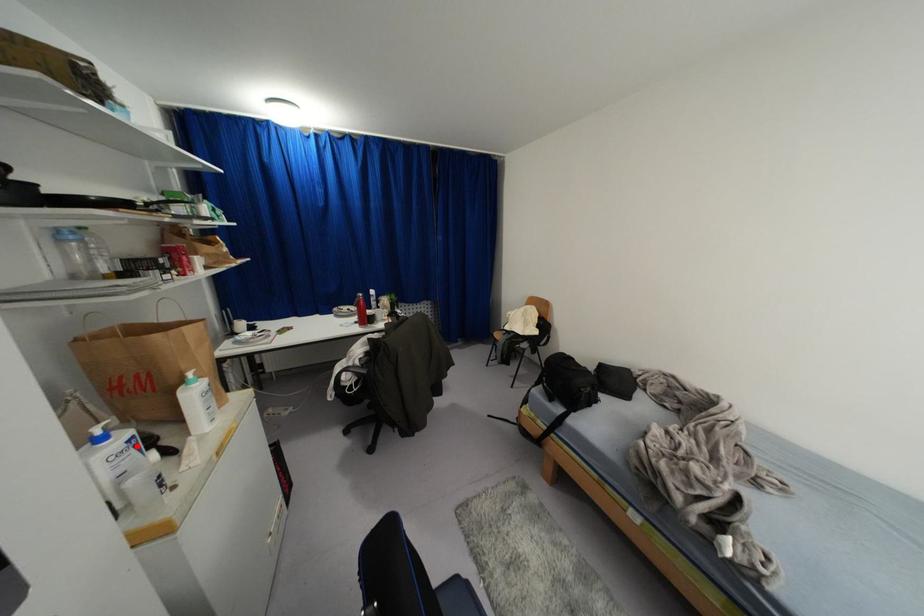
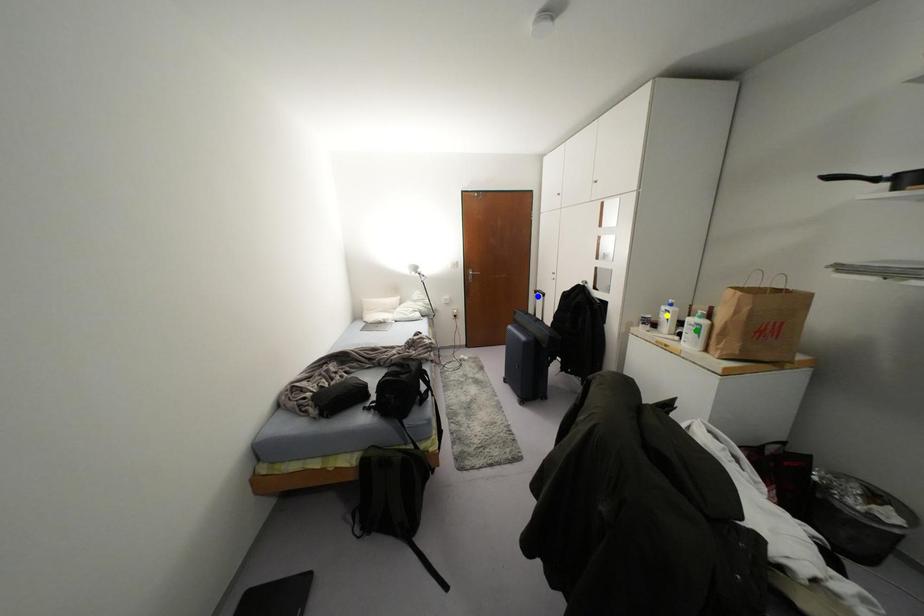
Question: I am providing you with two images of the same scene from different viewpoints. A red point is marked on the first image. You are given multiple points on the second image. Which mark in image 2 goes with the point in image 1?

Choices:
 (A) green point
 (B) blue point
 (C) yellow point

Answer: (C)